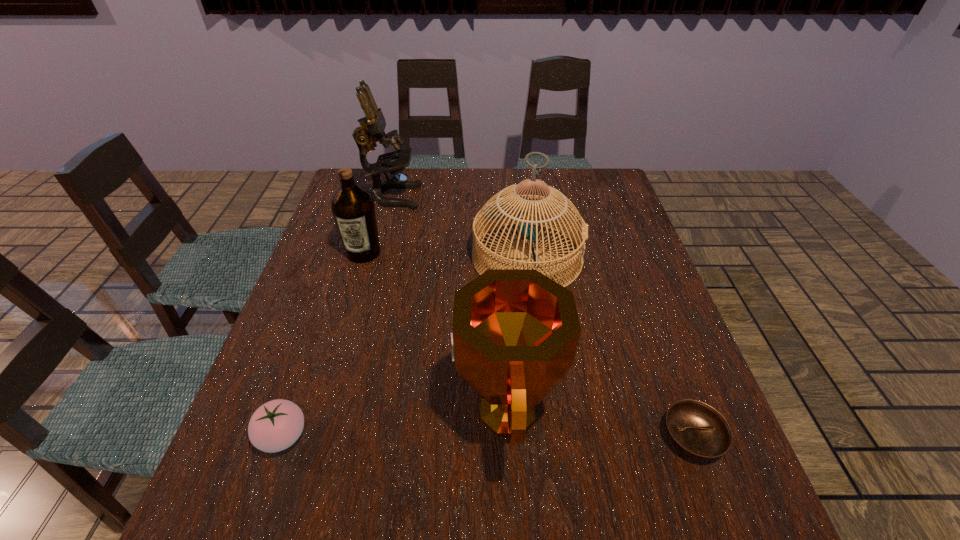
This screenshot has height=540, width=960. I want to click on microscope, so click(x=372, y=128).

Identify the location of the farthest object. The height and width of the screenshot is (540, 960). (372, 128).

This screenshot has height=540, width=960. What are the coordinates of `birdcage` in the screenshot? It's located at (498, 210).

Find the location of a particular element. The height and width of the screenshot is (540, 960). award is located at coordinates (515, 333).

Where is `olive oil`? olive oil is located at coordinates (353, 208).

Where is `the second shortest object`? the second shortest object is located at coordinates (276, 425).

This screenshot has height=540, width=960. I want to click on the rightmost object, so click(x=696, y=429).

Where is `soup bowl`? Image resolution: width=960 pixels, height=540 pixels. soup bowl is located at coordinates (696, 429).

Find the location of a particular element. The width and height of the screenshot is (960, 540). vacant space located at the eyepieces of the tallest object is located at coordinates (438, 197).

Find the location of a particular element. The image size is (960, 540). free space located 0.370m on the left of the birdcage is located at coordinates (338, 257).